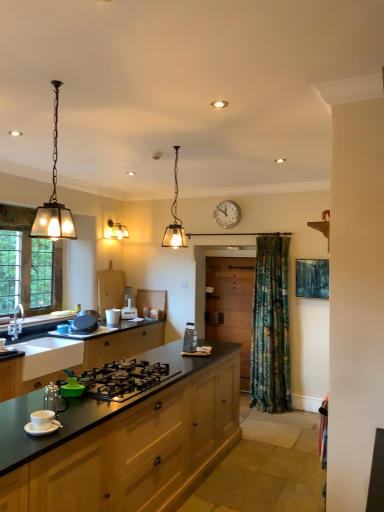
The height and width of the screenshot is (512, 384). I want to click on vacant space in front of white ceramic cup at lower left, arranged as the 4th appliance when viewed from the left, so click(x=24, y=441).